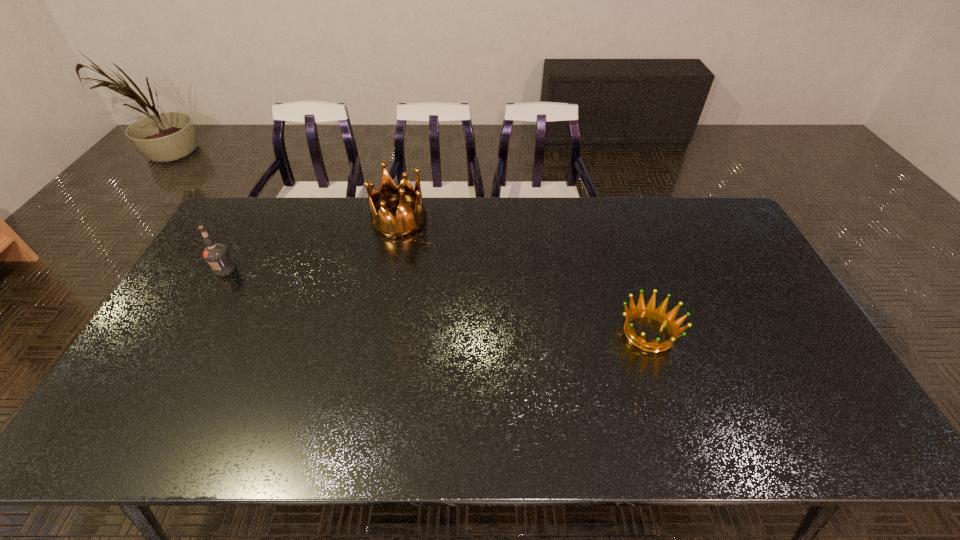
The image size is (960, 540). Find the location of `free location that satisfies the following two spatial constraints: 1. on the front label of the nearer crown; 2. on the right side of the vodka`. free location that satisfies the following two spatial constraints: 1. on the front label of the nearer crown; 2. on the right side of the vodka is located at coordinates (189, 333).

Where is `vacant space that satisfies the following two spatial constraints: 1. on the front label of the nearer crown; 2. on the right side of the second farthest object`? vacant space that satisfies the following two spatial constraints: 1. on the front label of the nearer crown; 2. on the right side of the second farthest object is located at coordinates (189, 333).

Identify the location of free region that satisfies the following two spatial constraints: 1. on the front label of the rightmost object; 2. on the left side of the vodka. (189, 333).